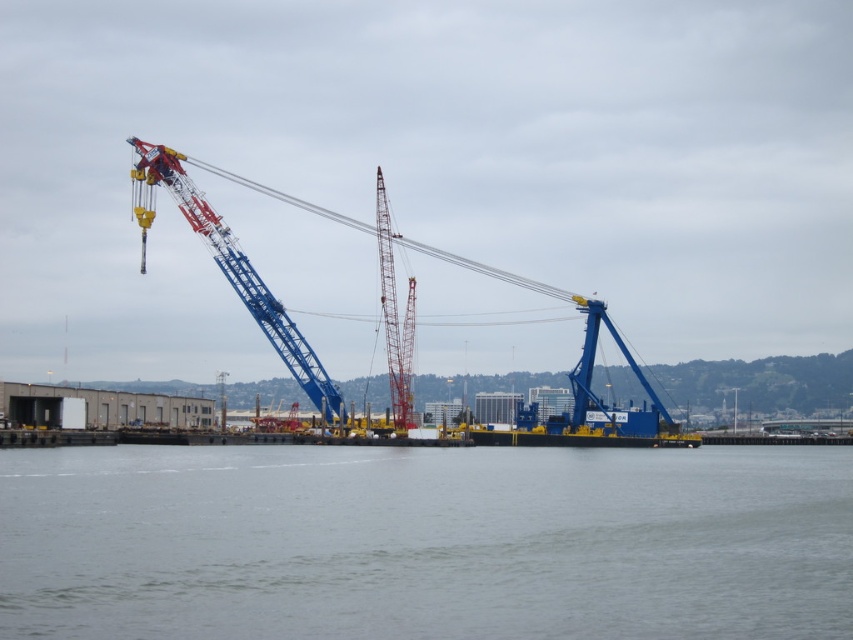
You are a crane operator assessing the harbor layout. You see the gray water at center and the metallic blue crane at center. Which object has a greater height from the observer perspective?

The metallic blue crane at center is taller than the gray water at center, so the metallic blue crane at center has a greater height from the observer perspective.

You are standing at the edge of the floating platform and want to reach both points, point (424,602) and point (239,268). Which point will you reach first if you walk straight towards them?

Point (424,602) is closer to the viewer than point (239,268), so you will reach point (424,602) first.

You are an engineer inspecting the harbor. You notice two cranes labeled as blue metallic crane at center and metallic blue crane at center. Which one has a greater width?

The blue metallic crane at center is wider than the metallic blue crane at center according to the description.